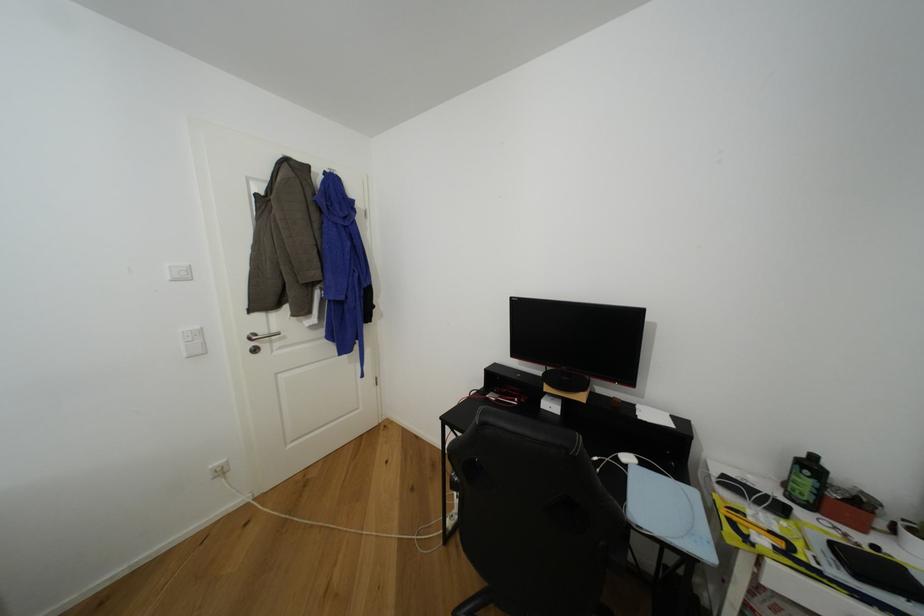
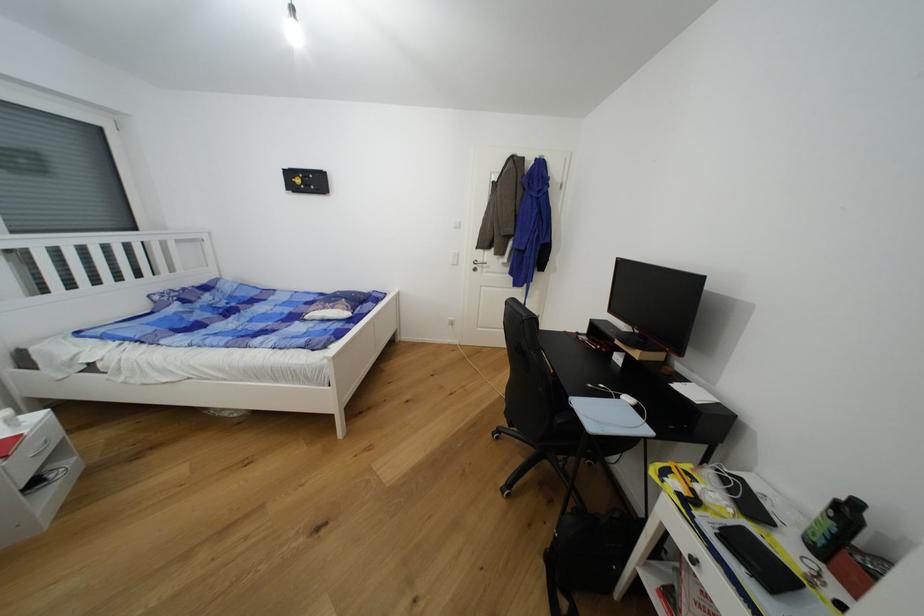
The point at (820, 459) is marked in the first image. Where is the corresponding point in the second image?

(862, 506)